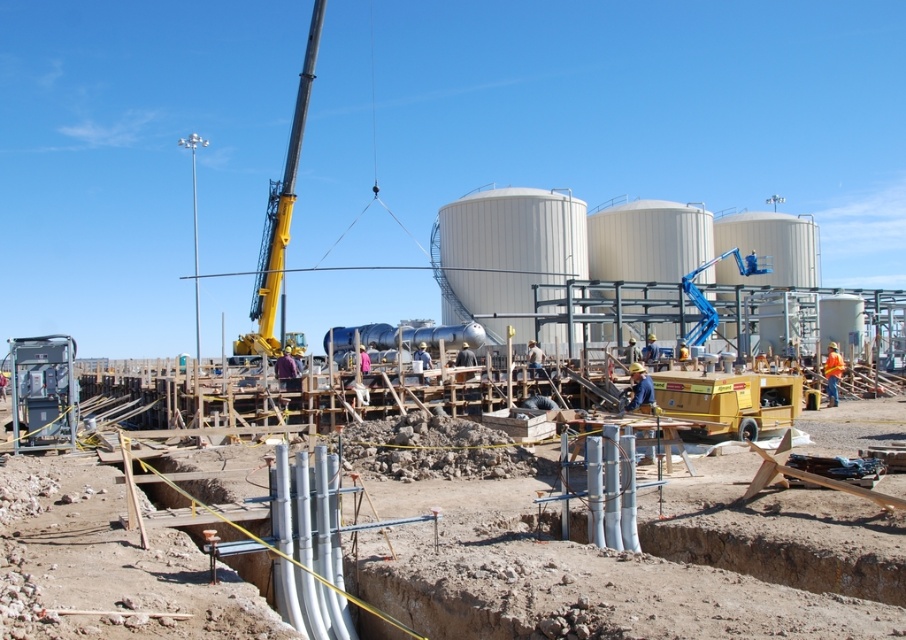
You are a construction worker who needs to access the white concrete pipes at center. However, there is a metallic gray generator at lower left in the way. Can you move the generator to reach the pipes?

The white concrete pipes at center is positioned under the metallic gray generator at lower left, so you would need to move the generator first to access the pipes.

You are a construction worker who needs to transport the white concrete pipes at center and the metallic gray generator at lower left using a truck with a 2.5 meter width limit. Can both items be placed side by side without exceeding the truck bed width?

The white concrete pipes at center are wider than the metallic gray generator at lower left. Since the truck bed has a 2.5 meter width limit, the combined width of both items may exceed the limit. However, without knowing the exact dimensions of each item, it is impossible to determine if they can fit side by side.